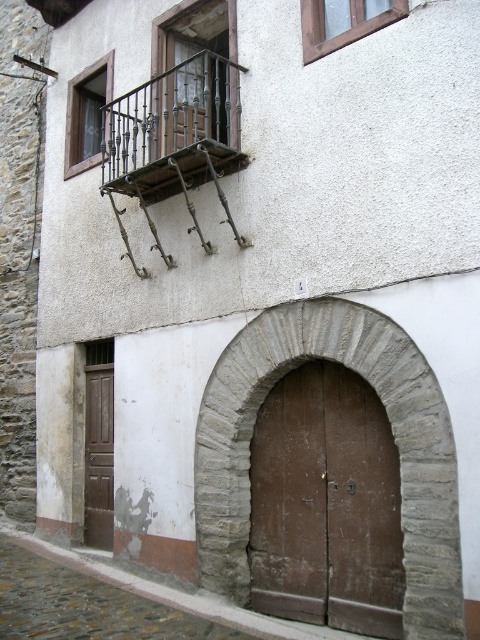
You are an architect assessing the building structure. You need to determine if the brown wooden door at center can fit through the stone arched doorway at center without any modifications. Based on their heights, what is your conclusion?

The stone arched doorway at center is taller than the brown wooden door at center, so the door can fit through the doorway without needing modifications.

You are a delivery person with a package that requires a 3 meter wide path to pass through. You are standing in front of the building and see the brown wooden door at center and the brown wooden door at lower left. Is there enough space between them for your delivery vehicle?

The brown wooden door at center is 3.01 meters from brown wooden door at lower left, so yes, there is enough space between them for the delivery vehicle since the distance is slightly more than 3 meters.

You are standing in front of the building and want to take a photo. You notice two points marked on the building wall. The first point is at coordinates point (288,589) and the second is at point (97,541). Which point will appear larger in your camera view?

Point (288,589) will appear larger in the camera view because it is closer to the camera than point (97,541).